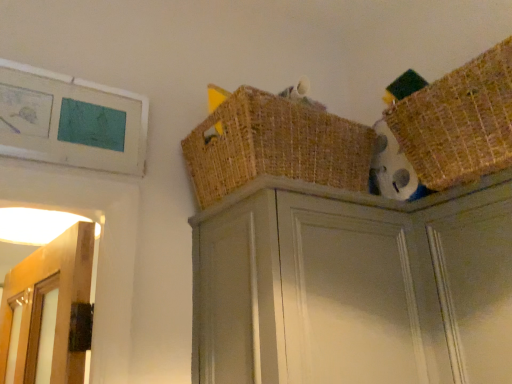
Question: Does point [473, 155] appear closer or farther from the camera than point [400, 256]?

Choices:
 (A) farther
 (B) closer

Answer: (B)

Question: Would you say woven brown basket at upper right, which appears as the 2th basket when viewed from the left, is to the left or to the right of matte gray cabinet at upper center in the picture?

Choices:
 (A) left
 (B) right

Answer: (B)

Question: Estimate the real-world distances between objects in this image. Which object is closer to the matte gray cabinet at upper center?

Choices:
 (A) woven brown basket at upper center, the second basket viewed from the right
 (B) woven brown basket at upper right, which is counted as the 1th basket, starting from the right

Answer: (A)

Question: Which object is positioned closest to the woven brown basket at upper center, the second basket viewed from the right?

Choices:
 (A) matte gray cabinet at upper center
 (B) woven brown basket at upper right, which is counted as the 1th basket, starting from the right

Answer: (A)